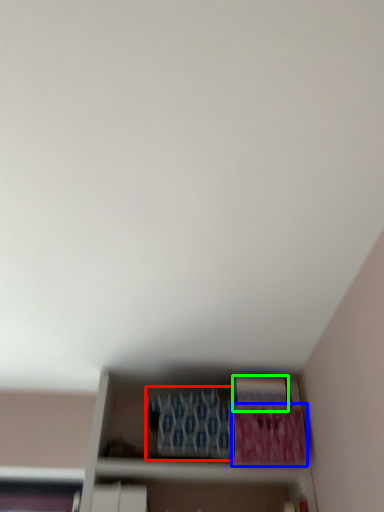
Question: Which is nearer to the paperback book (highlighted by a red box)? paperback book (highlighted by a blue box) or paperback book (highlighted by a green box).

Choices:
 (A) paperback book
 (B) paperback book

Answer: (A)